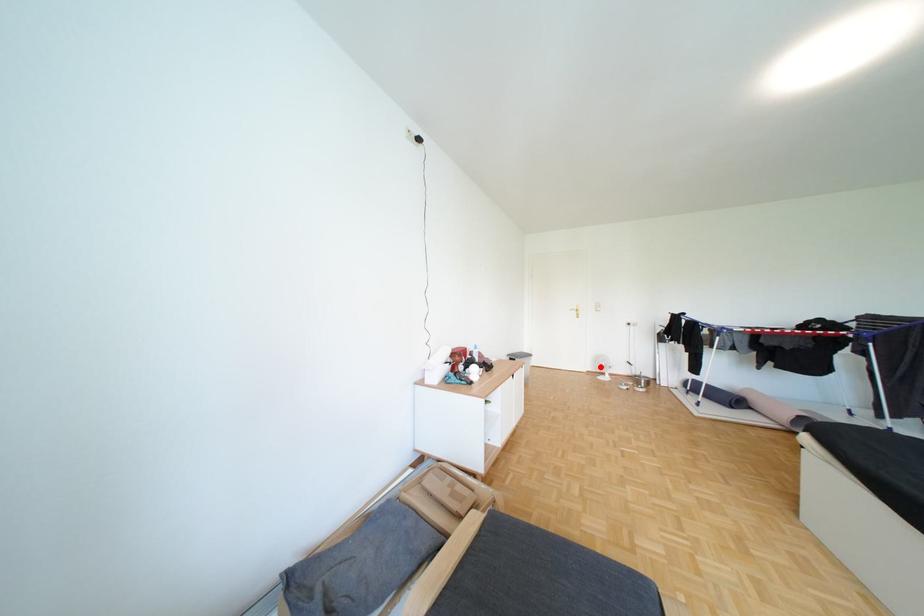
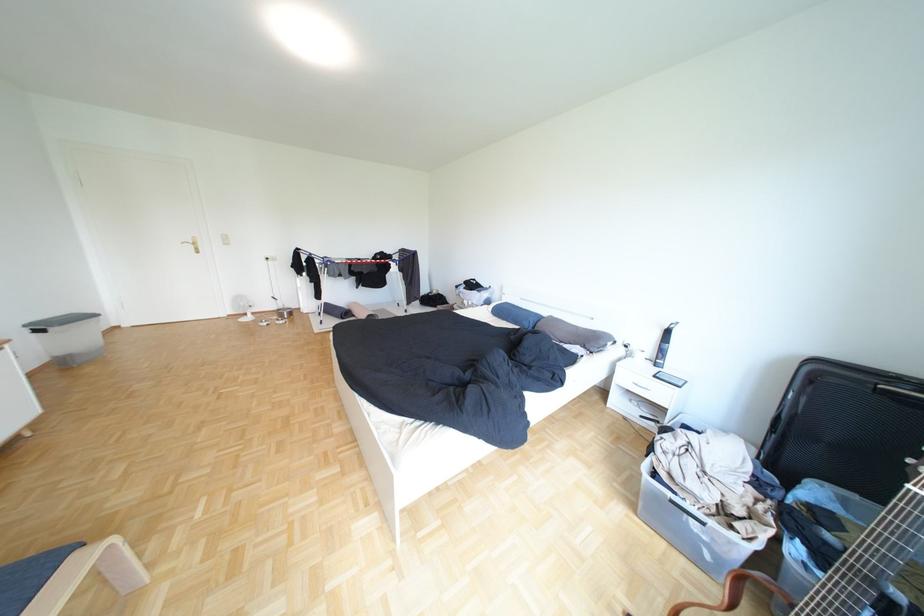
Question: A red point is marked in image1. In image2, is the corresponding 3D point closer to the camera or farther? Reply with the corresponding letter.

Choices:
 (A) The corresponding 3D point is closer.
 (B) The corresponding 3D point is farther.

Answer: (A)